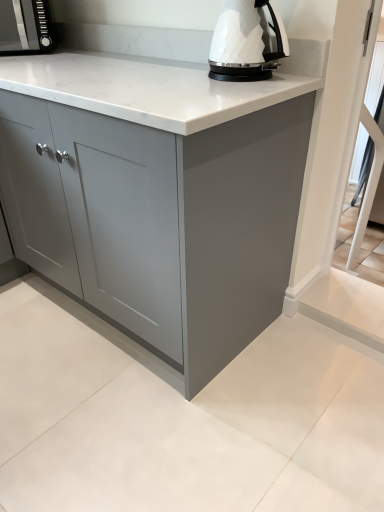
Question: Is white glossy electric kettle at upper center located outside matte gray cabinet at center?

Choices:
 (A) no
 (B) yes

Answer: (A)

Question: From the image's perspective, is white glossy electric kettle at upper center above matte gray cabinet at center?

Choices:
 (A) yes
 (B) no

Answer: (A)

Question: Is matte gray cabinet at center a part of white glossy electric kettle at upper center?

Choices:
 (A) yes
 (B) no

Answer: (B)

Question: Is white glossy electric kettle at upper center facing towards matte gray cabinet at center?

Choices:
 (A) yes
 (B) no

Answer: (A)

Question: Is white glossy electric kettle at upper center looking in the opposite direction of matte gray cabinet at center?

Choices:
 (A) no
 (B) yes

Answer: (B)

Question: Can you see white glossy electric kettle at upper center touching matte gray cabinet at center?

Choices:
 (A) yes
 (B) no

Answer: (B)

Question: Can you confirm if matte gray cabinet at center is thinner than white glossy electric kettle at upper center?

Choices:
 (A) no
 (B) yes

Answer: (A)

Question: Would you say matte gray cabinet at center is outside white glossy electric kettle at upper center?

Choices:
 (A) yes
 (B) no

Answer: (A)

Question: Is matte gray cabinet at center in front of white glossy electric kettle at upper center?

Choices:
 (A) yes
 (B) no

Answer: (A)

Question: Considering the relative positions of matte gray cabinet at center and white glossy electric kettle at upper center in the image provided, is matte gray cabinet at center to the left of white glossy electric kettle at upper center from the viewer's perspective?

Choices:
 (A) no
 (B) yes

Answer: (B)

Question: Are matte gray cabinet at center and white glossy electric kettle at upper center making contact?

Choices:
 (A) no
 (B) yes

Answer: (A)

Question: Considering the relative sizes of matte gray cabinet at center and white glossy electric kettle at upper center in the image provided, is matte gray cabinet at center taller than white glossy electric kettle at upper center?

Choices:
 (A) yes
 (B) no

Answer: (A)

Question: Is matte gray cabinet at center completely or partially inside matte black microwave at upper left?

Choices:
 (A) yes
 (B) no

Answer: (B)